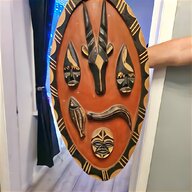
Identify the location of curtain. The height and width of the screenshot is (192, 192). (55, 147).